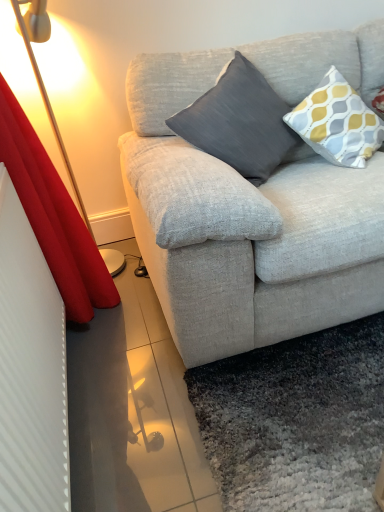
Question: Does red velvet curtain at left have a greater width compared to yellow and gray patterned pillow at upper right, the 2th pillow viewed from the left?

Choices:
 (A) no
 (B) yes

Answer: (A)

Question: Can you confirm if red velvet curtain at left is smaller than yellow and gray patterned pillow at upper right, the 2th pillow viewed from the left?

Choices:
 (A) no
 (B) yes

Answer: (A)

Question: Is red velvet curtain at left at the left side of yellow and gray patterned pillow at upper right, marked as the first pillow in a right-to-left arrangement?

Choices:
 (A) yes
 (B) no

Answer: (A)

Question: Can you confirm if red velvet curtain at left is bigger than yellow and gray patterned pillow at upper right, the 2th pillow viewed from the left?

Choices:
 (A) yes
 (B) no

Answer: (A)

Question: Can you confirm if red velvet curtain at left is thinner than yellow and gray patterned pillow at upper right, marked as the first pillow in a right-to-left arrangement?

Choices:
 (A) no
 (B) yes

Answer: (B)

Question: Considering the positions of yellow and gray patterned pillow at upper right, marked as the first pillow in a right-to-left arrangement, and dark gray fabric pillow at center, the 1th pillow positioned from the left, in the image, is yellow and gray patterned pillow at upper right, marked as the first pillow in a right-to-left arrangement, bigger or smaller than dark gray fabric pillow at center, the 1th pillow positioned from the left,?

Choices:
 (A) small
 (B) big

Answer: (A)

Question: Is point (327, 113) positioned closer to the camera than point (259, 141)?

Choices:
 (A) farther
 (B) closer

Answer: (A)

Question: From the image's perspective, is yellow and gray patterned pillow at upper right, marked as the first pillow in a right-to-left arrangement, located above or below dark gray fabric pillow at center, placed as the second pillow when sorted from right to left?

Choices:
 (A) above
 (B) below

Answer: (A)

Question: Considering the relative positions of yellow and gray patterned pillow at upper right, the 2th pillow viewed from the left, and dark gray fabric pillow at center, placed as the second pillow when sorted from right to left, in the image provided, is yellow and gray patterned pillow at upper right, the 2th pillow viewed from the left, to the left or to the right of dark gray fabric pillow at center, placed as the second pillow when sorted from right to left,?

Choices:
 (A) left
 (B) right

Answer: (B)

Question: Choose the correct answer: Is dark gray fabric pillow at center, the 1th pillow positioned from the left, inside yellow and gray patterned pillow at upper right, marked as the first pillow in a right-to-left arrangement, or outside it?

Choices:
 (A) outside
 (B) inside

Answer: (A)

Question: Based on their sizes in the image, would you say dark gray fabric pillow at center, the 1th pillow positioned from the left, is bigger or smaller than yellow and gray patterned pillow at upper right, marked as the first pillow in a right-to-left arrangement?

Choices:
 (A) big
 (B) small

Answer: (A)

Question: From a real-world perspective, is dark gray fabric pillow at center, the 1th pillow positioned from the left, physically located above or below yellow and gray patterned pillow at upper right, the 2th pillow viewed from the left?

Choices:
 (A) above
 (B) below

Answer: (B)

Question: Based on their positions, is dark gray fabric pillow at center, the 1th pillow positioned from the left, located to the left or right of yellow and gray patterned pillow at upper right, marked as the first pillow in a right-to-left arrangement?

Choices:
 (A) right
 (B) left

Answer: (B)

Question: From a real-world perspective, is red velvet curtain at left physically located above or below dark gray fabric pillow at center, placed as the second pillow when sorted from right to left?

Choices:
 (A) above
 (B) below

Answer: (B)

Question: Is red velvet curtain at left spatially inside dark gray fabric pillow at center, the 1th pillow positioned from the left, or outside of it?

Choices:
 (A) inside
 (B) outside

Answer: (B)